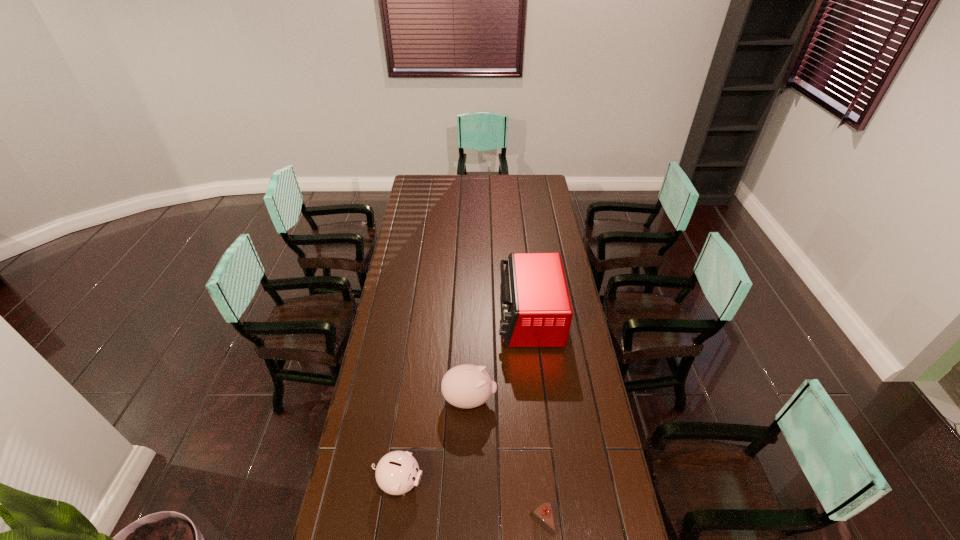
In order to click on free point that satisfies the following two spatial constraints: 1. on the front side of the nearer piggy bank; 2. on the left side of the shortest object in this screenshot , I will do `click(394, 523)`.

Locate an element on the screen. This screenshot has width=960, height=540. vacant space that satisfies the following two spatial constraints: 1. on the front side of the leftmost object; 2. on the left side of the shortest object is located at coordinates (394, 523).